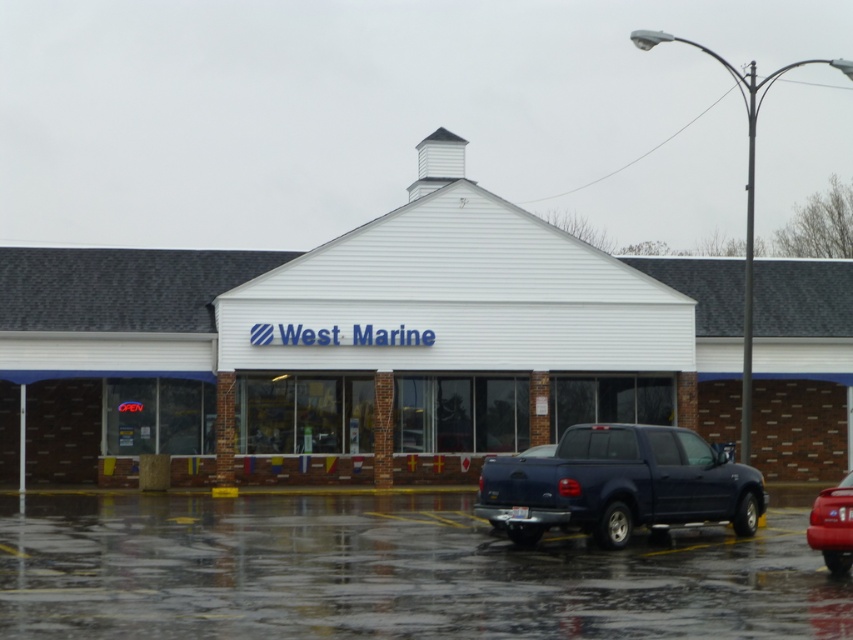
You are a delivery driver who needs to park your truck in the parking lot of the West Marine store. You see the dark blue matte truck at lower center and the shiny red car at lower right. Which vehicle is blocking your path to the parking spot closest to the entrance?

The dark blue matte truck at lower center is positioned over the shiny red car at lower right, meaning it is blocking the path to the parking spot closest to the entrance.

You are a delivery driver who needs to park your truck in the parking lot of the West Marine store. You see the wet asphalt at lower center and the dark blue matte truck at lower center. Which area has more space to park your truck?

The wet asphalt at lower center has a larger size compared to the dark blue matte truck at lower center, so there is more space to park your truck there.

You are a delivery driver arriving at the West Marine store. You need to park your truck but there is only space between the wet asphalt at lower center and the shiny red car at lower right. Can your truck fit there?

The wet asphalt at lower center is shorter than the shiny red car at lower right. Since the space between them is shorter than the truck, your truck cannot fit there.